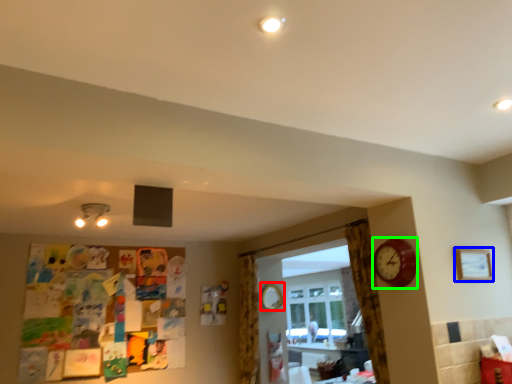
Question: Considering the real-world distances, which object is closest to mirror (highlighted by a red box)? picture frame (highlighted by a blue box) or clock (highlighted by a green box).

Choices:
 (A) picture frame
 (B) clock

Answer: (B)